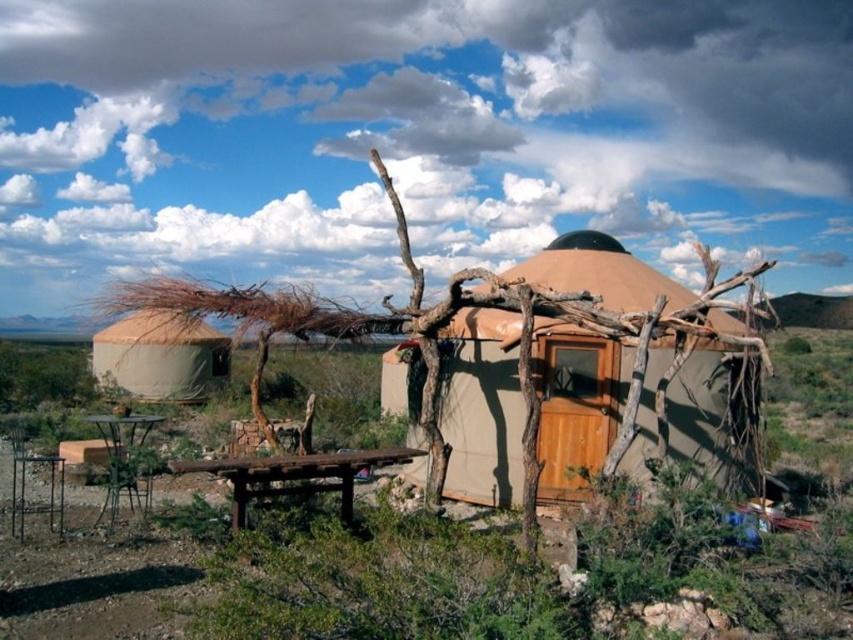
You are planning to set up a tent in the desert. You have a tent that requires a space larger than the metallic brown picnic table at lower left. Can the beige canvas yurt at center provide sufficient space for your tent?

The beige canvas yurt at center has a larger size compared to the metallic brown picnic table at lower left, so yes, the beige canvas yurt at center can provide sufficient space for your tent since it is bigger than the picnic table.

You are planning to set up a tent in the desert and have arrived at the location shown. You see the beige canvas yurt at center and the metallic brown picnic table at lower left. Which object is blocking your path to the picnic table?

The beige canvas yurt at center is positioned over the metallic brown picnic table at lower left, meaning the yurt is blocking the path to the picnic table.